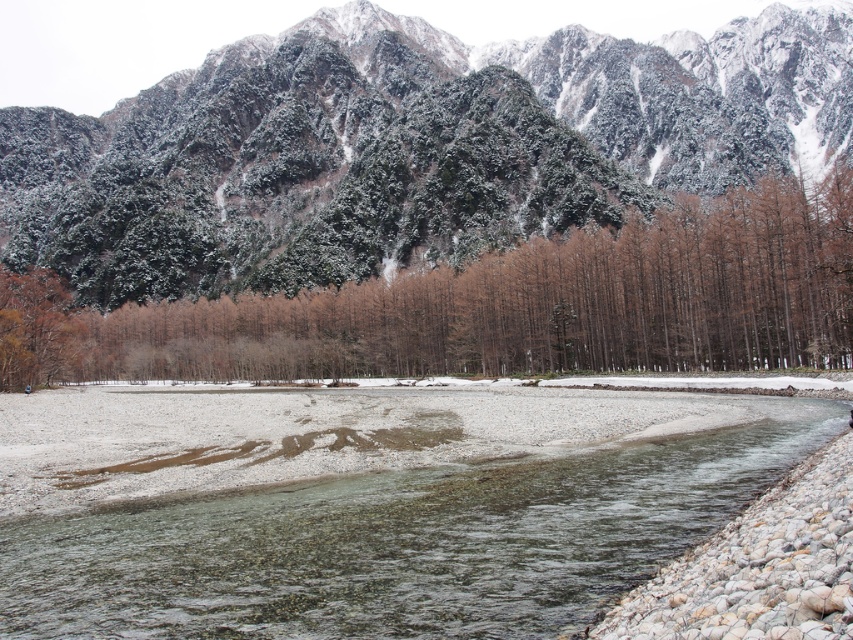
Question: Considering the real-world distances, which object is closest to the clear gravel bed at center?

Choices:
 (A) brown matte trees at center
 (B) green textured mountain at upper center

Answer: (A)

Question: Does clear gravel bed at center have a greater width compared to brown matte trees at center?

Choices:
 (A) yes
 (B) no

Answer: (B)

Question: Can you confirm if clear gravel bed at center is positioned below brown matte trees at center?

Choices:
 (A) no
 (B) yes

Answer: (B)

Question: Which object appears farthest from the camera in this image?

Choices:
 (A) green textured mountain at upper center
 (B) clear gravel bed at center
 (C) brown matte trees at center

Answer: (A)

Question: Is green textured mountain at upper center above brown matte trees at center?

Choices:
 (A) yes
 (B) no

Answer: (A)

Question: Which object appears closest to the camera in this image?

Choices:
 (A) brown matte trees at center
 (B) clear gravel bed at center
 (C) green textured mountain at upper center

Answer: (B)